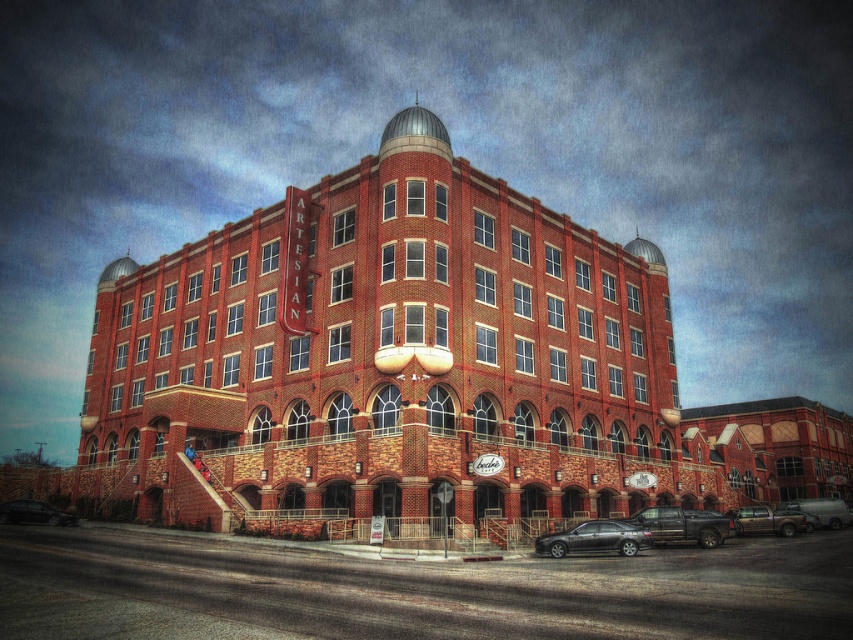
You are a photographer setting up a shot of the brick building at lower right and the shiny black sedan at lower left. If you want to frame both subjects so that the building appears larger than the sedan in the photo, where should you position the camera relative to each object?

The brick building at lower right might be wider than the shiny black sedan at lower left, so to make the building appear larger in the photo, position the camera closer to the brick building at lower right and farther from the shiny black sedan at lower left.

You are standing at the entrance of the large brick building and notice two trucks parked at the lower right corner. Which truck is nearer to you, the brown matte truck at lower right or the metallic silver truck at lower right?

The brown matte truck at lower right is closer to the viewer than the metallic silver truck at lower right, so the brown matte truck is nearer to you.